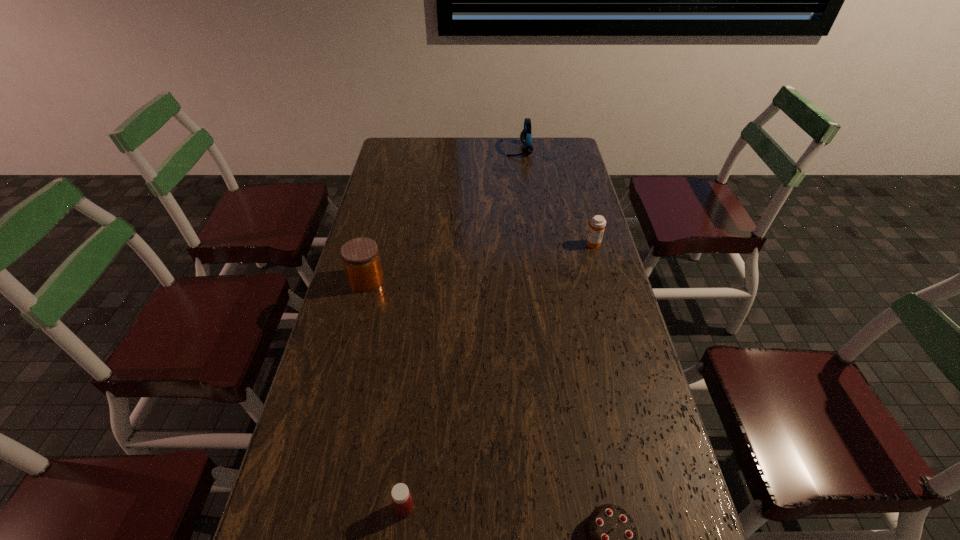
Image resolution: width=960 pixels, height=540 pixels. I want to click on free point located on the right of the jar, so click(433, 280).

The image size is (960, 540). Find the location of `free space located on the back of the rightmost object`. free space located on the back of the rightmost object is located at coordinates (588, 231).

This screenshot has width=960, height=540. In order to click on free space located on the back of the fourth object from right to left in this screenshot , I will do `click(420, 375)`.

Identify the location of object present at the far edge. (525, 136).

This screenshot has width=960, height=540. I want to click on object at the left edge, so click(360, 256).

The width and height of the screenshot is (960, 540). I want to click on object present at the right edge, so click(x=597, y=224).

I want to click on free space at the far edge, so click(441, 156).

You are a GUI agent. You are given a task and a screenshot of the screen. Output one action in this format:
    pyautogui.click(x=<x>, y=<y>)
    Task: Click on the blank space at the left edge
    This screenshot has width=960, height=540.
    Given the screenshot: What is the action you would take?
    pyautogui.click(x=341, y=329)

Locate an element on the screen. This screenshot has height=540, width=960. free space at the right edge is located at coordinates (574, 254).

Where is `free region at the far left corner of the desktop`? This screenshot has width=960, height=540. free region at the far left corner of the desktop is located at coordinates (387, 156).